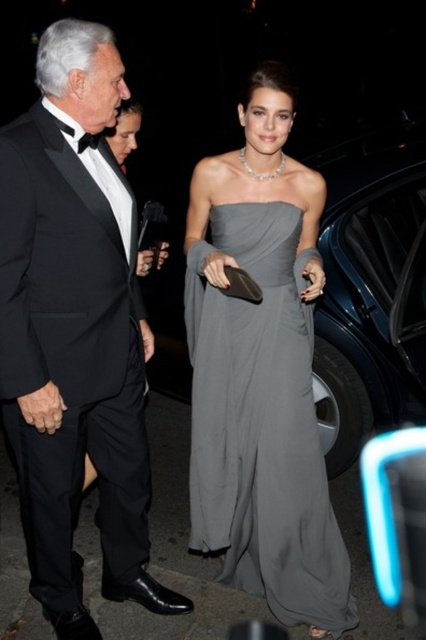
Between black satin tuxedo at left and gray satin dress at center, which one is positioned higher?

black satin tuxedo at left is higher up.

Based on the photo, which is more to the right, black satin tuxedo at left or gray satin dress at center?

→ Positioned to the right is gray satin dress at center.

Find the location of `black satin tuxedo at left`. black satin tuxedo at left is located at coordinates (74, 330).